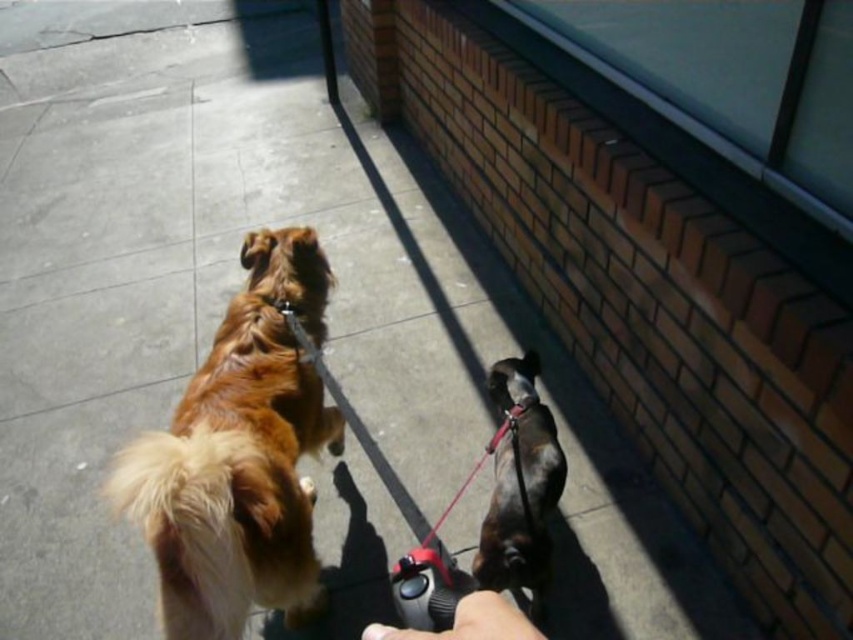
The width and height of the screenshot is (853, 640). Find the location of `smooth leather leash at lower center`. smooth leather leash at lower center is located at coordinates (469, 621).

Which is more to the right, smooth leather leash at lower center or smooth nylon leash at center?

smooth nylon leash at center is more to the right.

Between point (511, 604) and point (440, 561), which one is positioned behind?

The point (511, 604) is behind.

This screenshot has height=640, width=853. I want to click on smooth leather leash at lower center, so click(x=469, y=621).

Is golden fur dog at center thinner than brown fur dog at lower right?

In fact, golden fur dog at center might be wider than brown fur dog at lower right.

Is golden fur dog at center shorter than brown fur dog at lower right?

In fact, golden fur dog at center may be taller than brown fur dog at lower right.

Is point (287, 531) positioned before point (527, 442)?

Yes, it is.

What are the coordinates of `golden fur dog at center` in the screenshot? It's located at (239, 456).

Is golden fur dog at center to the right of smooth leather leash at lower center from the viewer's perspective?

In fact, golden fur dog at center is to the left of smooth leather leash at lower center.

Is point (138, 486) closer to viewer compared to point (492, 605)?

No, it is not.

Who is more forward, (329, 280) or (376, 630)?

Point (376, 630)

At what (x,y) coordinates should I click in order to perform the action: click on golden fur dog at center. Please return your answer as a coordinate pair (x, y). The width and height of the screenshot is (853, 640). Looking at the image, I should click on (239, 456).